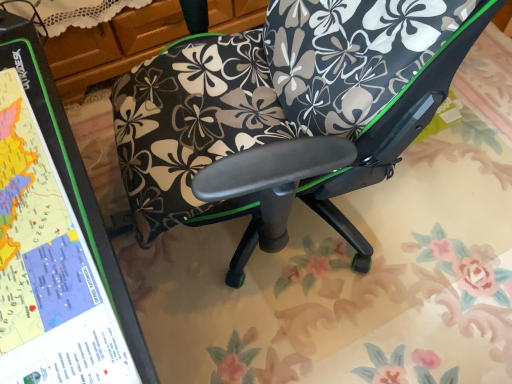
What do you see at coordinates (54, 240) in the screenshot? I see `green matte map at left` at bounding box center [54, 240].

Where is `green matte map at left`? green matte map at left is located at coordinates (54, 240).

Consider the image. What is the approximate width of green matte map at left?

green matte map at left is 5.68 inches in width.

What do you see at coordinates (286, 112) in the screenshot? I see `floral-patterned fabric chair at center` at bounding box center [286, 112].

Where is `floral-patterned fabric chair at center`? This screenshot has width=512, height=384. floral-patterned fabric chair at center is located at coordinates (286, 112).

Where is `green matte map at left`? Image resolution: width=512 pixels, height=384 pixels. green matte map at left is located at coordinates (54, 240).

Which is more to the right, green matte map at left or floral-patterned fabric chair at center?

From the viewer's perspective, floral-patterned fabric chair at center appears more on the right side.

Is green matte map at left closer to camera compared to floral-patterned fabric chair at center?

Yes, green matte map at left is closer to the viewer.

Is point (95, 257) closer to camera compared to point (266, 24)?

Yes, point (95, 257) is in front of point (266, 24).

From the image's perspective, between green matte map at left and floral-patterned fabric chair at center, who is located below?

green matte map at left is shown below in the image.

From a real-world perspective, relative to floral-patterned fabric chair at center, is green matte map at left vertically above or below?

In terms of real-world spatial position, green matte map at left is above floral-patterned fabric chair at center.

Between green matte map at left and floral-patterned fabric chair at center, which one has larger width?

With larger width is floral-patterned fabric chair at center.

Is green matte map at left shorter than floral-patterned fabric chair at center?

Correct, green matte map at left is not as tall as floral-patterned fabric chair at center.

Does green matte map at left have a smaller size compared to floral-patterned fabric chair at center?

Correct, green matte map at left occupies less space than floral-patterned fabric chair at center.

Would you say floral-patterned fabric chair at center is part of green matte map at left's contents?

No.

Is green matte map at left with floral-patterned fabric chair at center?

They are not placed beside each other.

Could you tell me if green matte map at left is turned towards floral-patterned fabric chair at center?

No, green matte map at left is not turned towards floral-patterned fabric chair at center.

What's the angular difference between green matte map at left and floral-patterned fabric chair at center's facing directions?

6.56 degrees.

This screenshot has width=512, height=384. I want to click on chair directly beneath the green matte map at left (from a real-world perspective), so click(286, 112).

Between floral-patterned fabric chair at center and green matte map at left, which one appears on the right side from the viewer's perspective?

floral-patterned fabric chair at center is more to the right.

Based on the photo, considering the relative positions of floral-patterned fabric chair at center and green matte map at left in the image provided, is floral-patterned fabric chair at center in front of green matte map at left?

No, floral-patterned fabric chair at center is further to the viewer.

Which is behind, point (302, 61) or point (85, 377)?

The point (302, 61) is farther.

From the image's perspective, is floral-patterned fabric chair at center above or below green matte map at left?

Clearly, from the image's perspective, floral-patterned fabric chair at center is above green matte map at left.

From a real-world perspective, between floral-patterned fabric chair at center and green matte map at left, who is vertically lower?

floral-patterned fabric chair at center, from a real-world perspective.

Can you confirm if floral-patterned fabric chair at center is wider than green matte map at left?

Correct, the width of floral-patterned fabric chair at center exceeds that of green matte map at left.

Is floral-patterned fabric chair at center shorter than green matte map at left?

No, floral-patterned fabric chair at center is not shorter than green matte map at left.

In terms of size, does floral-patterned fabric chair at center appear bigger or smaller than green matte map at left?

floral-patterned fabric chair at center is bigger than green matte map at left.

Is floral-patterned fabric chair at center spatially inside green matte map at left, or outside of it?

floral-patterned fabric chair at center is not enclosed by green matte map at left.

Would you consider floral-patterned fabric chair at center to be distant from green matte map at left?

Actually, floral-patterned fabric chair at center and green matte map at left are a little close together.

Is floral-patterned fabric chair at center turned away from green matte map at left?

No, floral-patterned fabric chair at center is not facing the opposite direction of green matte map at left.

In the scene shown: What's the angular difference between floral-patterned fabric chair at center and green matte map at left's facing directions?

There is a 6.56-degree angle between the facing directions of floral-patterned fabric chair at center and green matte map at left.

Where is `chair above the green matte map at left (from the image's perspective)`? The width and height of the screenshot is (512, 384). chair above the green matte map at left (from the image's perspective) is located at coordinates [x=286, y=112].

Where is `bulletin board in front of the floral-patterned fabric chair at center`? The width and height of the screenshot is (512, 384). bulletin board in front of the floral-patterned fabric chair at center is located at coordinates (54, 240).

Where is `bulletin board that is above the floral-patterned fabric chair at center (from a real-world perspective)`? The width and height of the screenshot is (512, 384). bulletin board that is above the floral-patterned fabric chair at center (from a real-world perspective) is located at coordinates click(x=54, y=240).